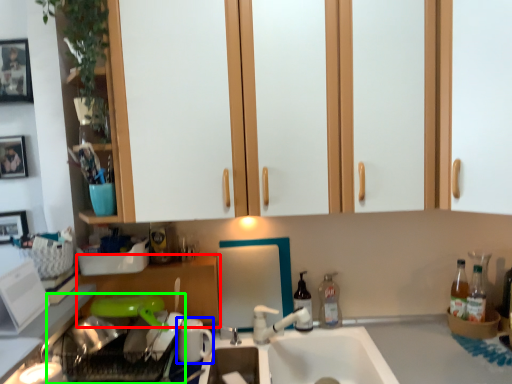
Question: Which is farther away from cabinetry (highlighted by a red box)? appliance (highlighted by a blue box) or dish washer (highlighted by a green box)?

Choices:
 (A) appliance
 (B) dish washer

Answer: (A)